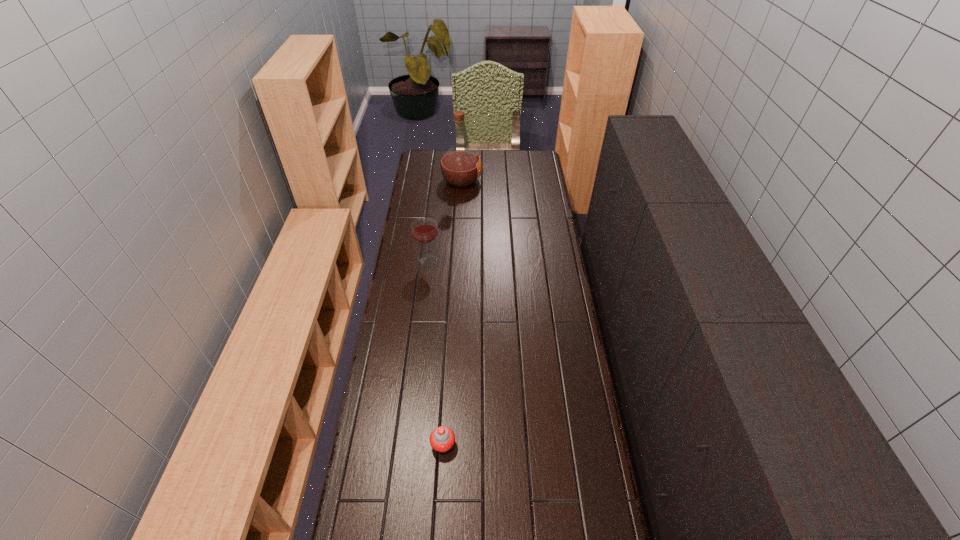
Where is `the farthest object`? Image resolution: width=960 pixels, height=540 pixels. the farthest object is located at coordinates 460,166.

This screenshot has width=960, height=540. I want to click on the tallest object, so click(460, 166).

You are a GUI agent. You are given a task and a screenshot of the screen. Output one action in this format:
    pyautogui.click(x=<x>, y=<y>)
    Task: Click on the second tallest object
    This screenshot has width=960, height=540.
    Given the screenshot: What is the action you would take?
    pyautogui.click(x=424, y=230)

Identify the location of the second nearest object. (424, 230).

This screenshot has width=960, height=540. Identify the location of cupcake. (442, 439).

In order to click on the nearest object in this screenshot , I will do `click(442, 439)`.

What are the coordinates of `blank space located 0.240m on the front label of the farthest object` in the screenshot? It's located at (525, 180).

Find the location of `free space located 0.160m on the front of the wineglass`. free space located 0.160m on the front of the wineglass is located at coordinates (424, 295).

Locate an element on the screen. The width and height of the screenshot is (960, 540). vacant space located on the back of the shortest object is located at coordinates (449, 345).

The image size is (960, 540). I want to click on object located in the far edge section of the desktop, so click(x=460, y=166).